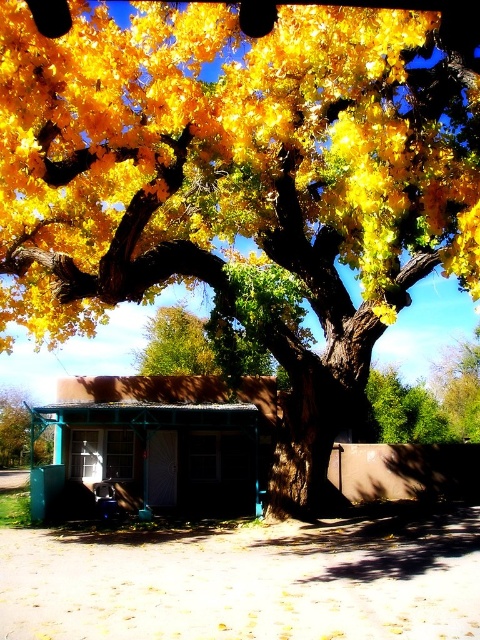
Who is shorter, green painted wood hut at center or yellow leafy tree at center?

With less height is green painted wood hut at center.

Is green painted wood hut at center positioned before yellow leafy tree at center?

Yes, it is in front of yellow leafy tree at center.

Does point (127, 392) come closer to viewer compared to point (200, 365)?

That is True.

Find the location of `green painted wood hut at center`. green painted wood hut at center is located at coordinates (165, 440).

Can you confirm if green painted wood hut at center is thinner than green metallic pole at lower left?

Incorrect, green painted wood hut at center's width is not less than green metallic pole at lower left's.

Where is `green painted wood hut at center`? The width and height of the screenshot is (480, 640). green painted wood hut at center is located at coordinates (165, 440).

Who is lower down, yellow leafy tree at center or green metallic pole at lower left?

green metallic pole at lower left is lower down.

Does yellow leafy tree at center appear under green metallic pole at lower left?

No, yellow leafy tree at center is not below green metallic pole at lower left.

Where is `yellow leafy tree at center`? yellow leafy tree at center is located at coordinates (176, 346).

At what (x,y) coordinates should I click in order to perform the action: click on yellow leafy tree at center. Please return your answer as a coordinate pair (x, y). Looking at the image, I should click on (176, 346).